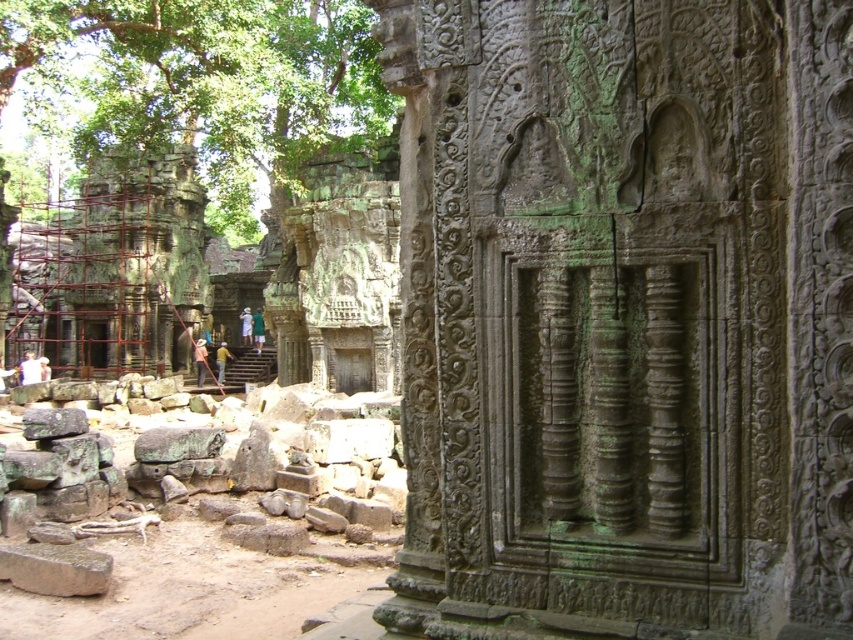
You are an archaeologist examining the ancient stone structure. You notice two green elements in the scene. Which one is narrower between the green stone carving at center and the green mossy stone at upper left?

The green stone carving at center has a lesser width compared to the green mossy stone at upper left, so it is narrower.

You are an archaeologist examining the ancient stone structure. You notice a green stone carving at center. Where exactly is the green stone carving located in terms of coordinates?

The green stone carving at center is located at coordinates point (624, 317).

You are an archaeologist examining the ancient stone structure. You notice the green stone carving at center and the green mossy stone at upper left. Which object is nearer to you?

The green stone carving at center is closer to the viewer than the green mossy stone at upper left, so the green stone carving at center is nearer to you.